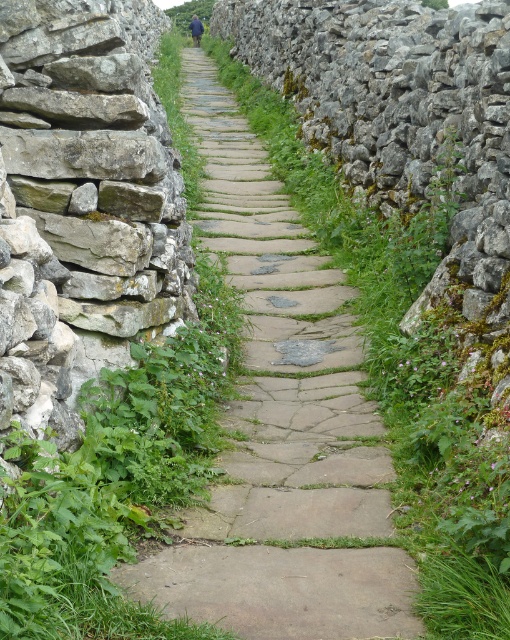
Which of these two, rough stone wall at left or green leafy grass at center, stands taller?

green leafy grass at center

Is rough stone wall at left thinner than green leafy grass at center?

Yes.

Where is `rough stone wall at left`? The image size is (510, 640). rough stone wall at left is located at coordinates (83, 204).

The height and width of the screenshot is (640, 510). I want to click on rough stone wall at left, so click(x=83, y=204).